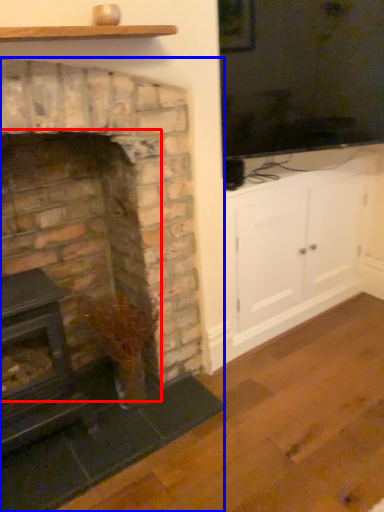
Question: Among these objects, which one is nearest to the camera, fireplace (highlighted by a red box) or fireplace (highlighted by a blue box)?

Choices:
 (A) fireplace
 (B) fireplace

Answer: (B)